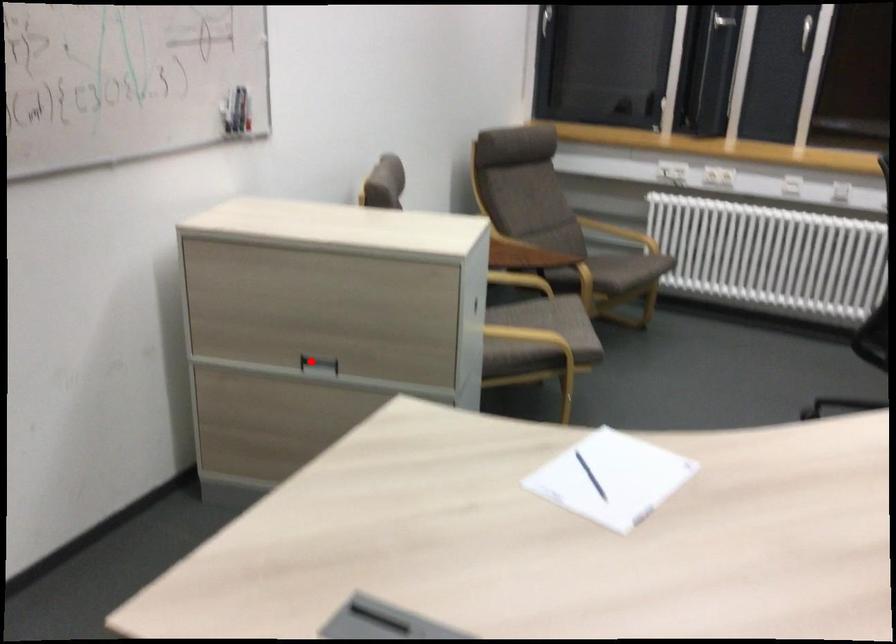
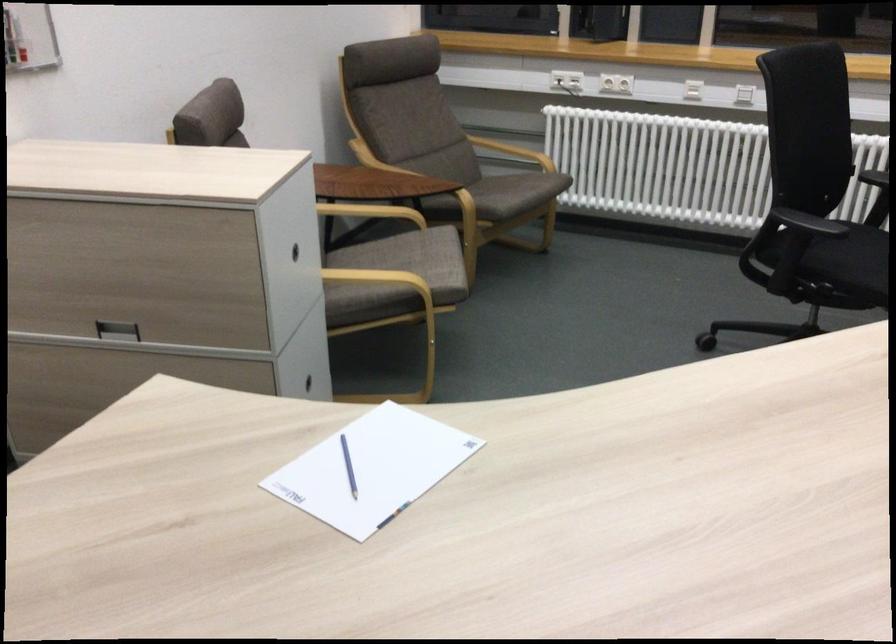
Question: I am providing you with two images of the same scene from different viewpoints. Image1 has a red point marked. In image2, the corresponding 3D location appears at what relative position? Reply with the corresponding letter.

Choices:
 (A) Closer
 (B) Farther

Answer: (A)